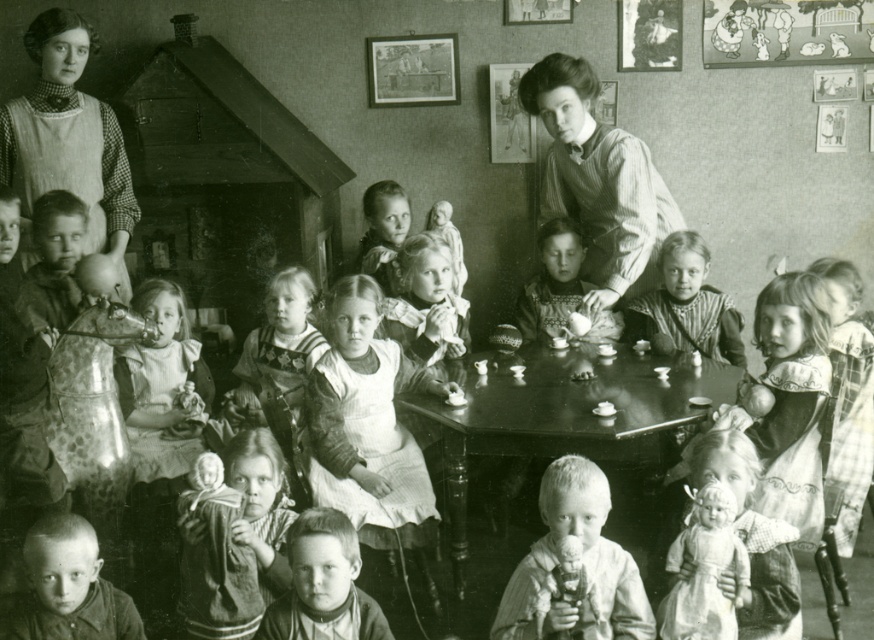
Is smooth white doll at center further to camera compared to smooth brown hair at center?

Yes, it is behind smooth brown hair at center.

Does point (588, 518) come behind point (340, 561)?

Yes, point (588, 518) is behind point (340, 561).

Identify the location of smooth white doll at center. (576, 564).

Is point (344, 312) positioned before point (207, 586)?

No, it is behind (207, 586).

Between white cotton dress at center and soft cloth doll at center, which one has more height?

With more height is white cotton dress at center.

Who is more distant from viewer, [371,368] or [189,506]?

The point [371,368] is behind.

You are a GUI agent. You are given a task and a screenshot of the screen. Output one action in this format:
    pyautogui.click(x=<x>, y=<y>)
    Task: Click on the white cotton dress at center
    Image resolution: width=874 pixels, height=640 pixels.
    Given the screenshot: What is the action you would take?
    pyautogui.click(x=369, y=429)

Who is taller, smooth brown shirt at lower left or smooth white dress at center?

Standing taller between the two is smooth white dress at center.

The width and height of the screenshot is (874, 640). I want to click on smooth brown shirt at lower left, so click(68, 588).